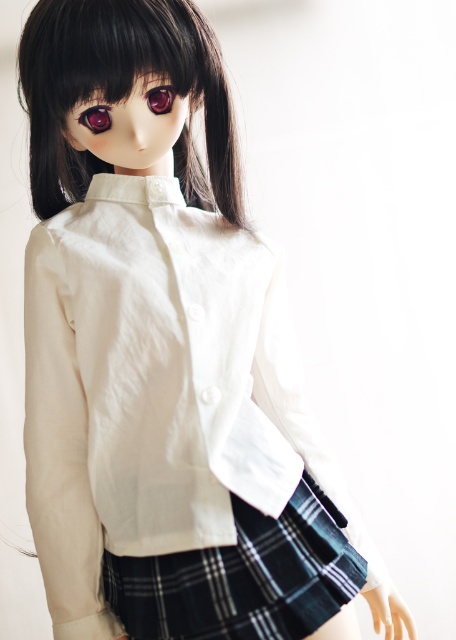
Question: Among these points, which one is farthest from the camera?

Choices:
 (A) (133, 32)
 (B) (86, 115)
 (C) (167, 90)
 (D) (207, 579)

Answer: (D)

Question: Which point is farther to the camera?

Choices:
 (A) black silky hair at upper center
 (B) glossy plastic eye at upper center

Answer: (B)

Question: Estimate the real-world distances between objects in this image. Which object is farther from the black silky hair at upper center?

Choices:
 (A) black plaid kilt at center
 (B) glossy plastic eye at upper center

Answer: (A)

Question: Is black plaid kilt at center to the right of glossy plastic eye at upper left from the viewer's perspective?

Choices:
 (A) no
 (B) yes

Answer: (B)

Question: Is black silky hair at upper center further to the viewer compared to black plaid kilt at center?

Choices:
 (A) yes
 (B) no

Answer: (B)

Question: Where is black silky hair at upper center located in relation to black plaid kilt at center in the image?

Choices:
 (A) left
 (B) right

Answer: (A)